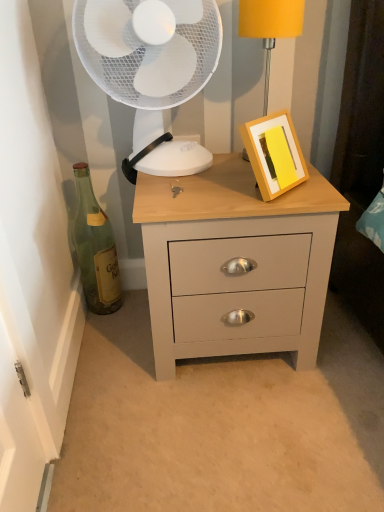
Question: Could matte yellow lampshade at upper right be considered to be inside white plastic fan at upper center?

Choices:
 (A) yes
 (B) no

Answer: (B)

Question: Is white plastic fan at upper center far from matte yellow lampshade at upper right?

Choices:
 (A) no
 (B) yes

Answer: (A)

Question: Does white plastic fan at upper center come behind matte yellow lampshade at upper right?

Choices:
 (A) yes
 (B) no

Answer: (B)

Question: Can you confirm if white plastic fan at upper center is bigger than matte yellow lampshade at upper right?

Choices:
 (A) no
 (B) yes

Answer: (B)

Question: From a real-world perspective, is white plastic fan at upper center located higher than matte yellow lampshade at upper right?

Choices:
 (A) yes
 (B) no

Answer: (A)

Question: From the image's perspective, is green glass bottle at left above or below matte gray chest of drawers at center?

Choices:
 (A) above
 (B) below

Answer: (A)

Question: From a real-world perspective, is green glass bottle at left physically located above or below matte gray chest of drawers at center?

Choices:
 (A) above
 (B) below

Answer: (A)

Question: Looking at their shapes, would you say green glass bottle at left is wider or thinner than matte gray chest of drawers at center?

Choices:
 (A) thin
 (B) wide

Answer: (A)

Question: Considering the relative positions of green glass bottle at left and matte gray chest of drawers at center in the image provided, is green glass bottle at left to the left or to the right of matte gray chest of drawers at center?

Choices:
 (A) left
 (B) right

Answer: (A)

Question: Considering the positions of white plastic fan at upper center and matte gray chest of drawers at center in the image, is white plastic fan at upper center wider or thinner than matte gray chest of drawers at center?

Choices:
 (A) wide
 (B) thin

Answer: (B)

Question: Is white plastic fan at upper center bigger or smaller than matte gray chest of drawers at center?

Choices:
 (A) big
 (B) small

Answer: (B)

Question: Considering the positions of white plastic fan at upper center and matte gray chest of drawers at center in the image, is white plastic fan at upper center taller or shorter than matte gray chest of drawers at center?

Choices:
 (A) tall
 (B) short

Answer: (B)

Question: From a real-world perspective, is white plastic fan at upper center above or below matte gray chest of drawers at center?

Choices:
 (A) below
 (B) above

Answer: (B)

Question: Choose the correct answer: Is white plastic fan at upper center inside green glass bottle at left or outside it?

Choices:
 (A) inside
 (B) outside

Answer: (B)

Question: Considering their positions, is white plastic fan at upper center located in front of or behind green glass bottle at left?

Choices:
 (A) front
 (B) behind

Answer: (A)